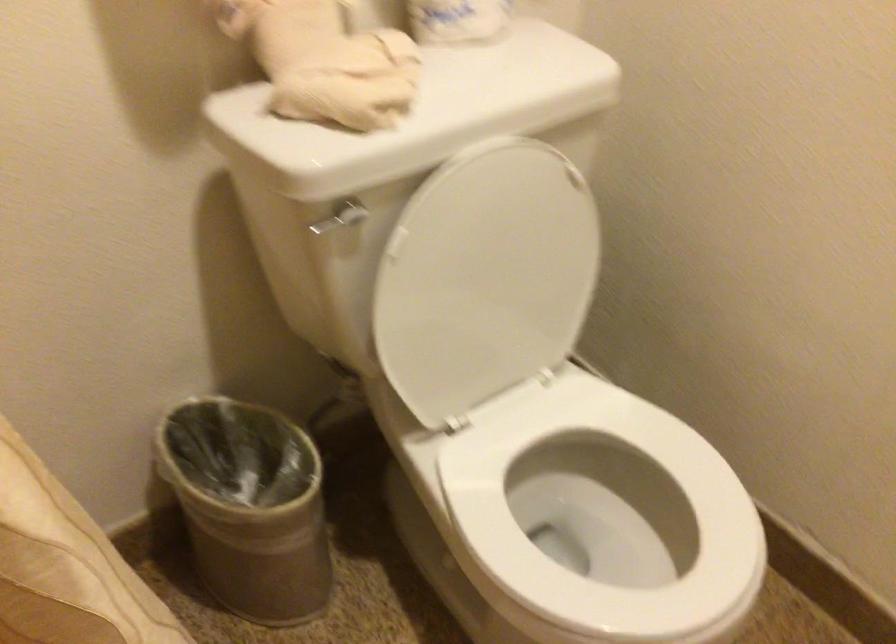
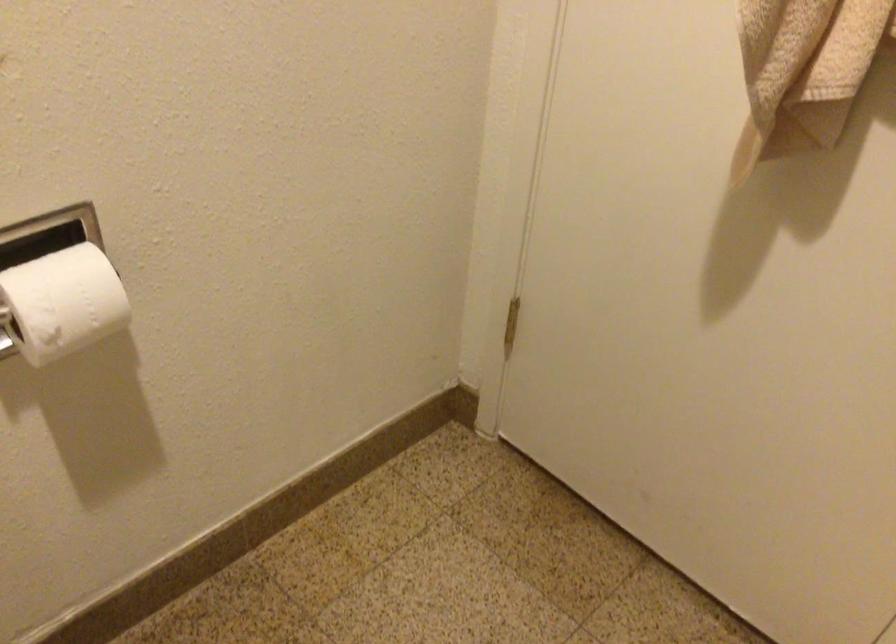
How did the camera likely rotate?

The camera rotated toward right-down.